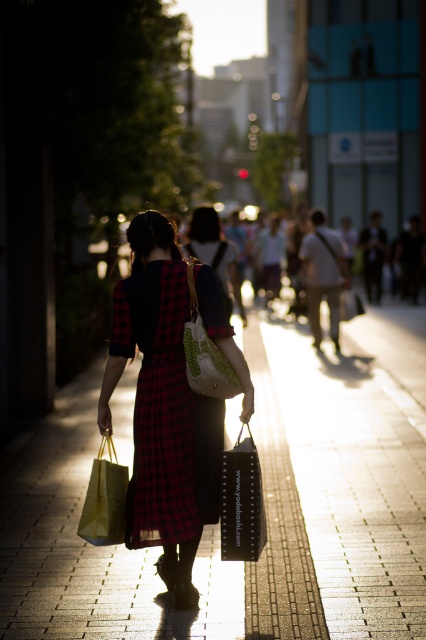
How much distance is there between black matte shopping bag at center and yellow paper shopping bag at lower left?

black matte shopping bag at center and yellow paper shopping bag at lower left are 73.11 centimeters apart.

Does black matte shopping bag at center appear on the right side of yellow paper shopping bag at lower left?

Yes, black matte shopping bag at center is to the right of yellow paper shopping bag at lower left.

Between point (256, 493) and point (121, 468), which one is positioned behind?

The point (121, 468) is behind.

Where is `black matte shopping bag at center`? This screenshot has height=640, width=426. black matte shopping bag at center is located at coordinates (241, 500).

Measure the distance from yellow paper shopping bag at lower left to green textured fabric handbag at center.

They are 85.15 centimeters apart.

Is yellow paper shopping bag at lower left below green textured fabric handbag at center?

Yes, yellow paper shopping bag at lower left is below green textured fabric handbag at center.

Image resolution: width=426 pixels, height=640 pixels. What do you see at coordinates (104, 499) in the screenshot?
I see `yellow paper shopping bag at lower left` at bounding box center [104, 499].

Find the location of a particular element. Image resolution: width=426 pixels, height=640 pixels. yellow paper shopping bag at lower left is located at coordinates (104, 499).

Does point (175, 435) lie behind point (94, 497)?

Yes, it is.

Does red plaid dress at center appear under yellow paper shopping bag at lower left?

No, red plaid dress at center is not below yellow paper shopping bag at lower left.

At what (x,y) coordinates should I click in order to perform the action: click on red plaid dress at center. Please return your answer as a coordinate pair (x, y). Image resolution: width=426 pixels, height=640 pixels. Looking at the image, I should click on click(166, 412).